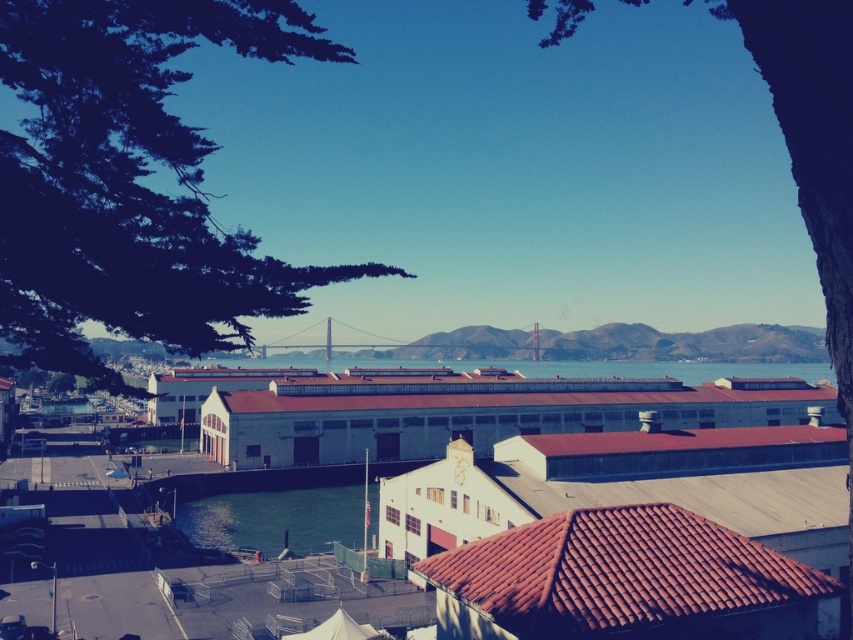
Between point (78, 22) and point (793, 371), which one is positioned behind?

Positioned behind is point (793, 371).

Find the location of a particular element. The image size is (853, 640). green leafy tree at upper left is located at coordinates (x=131, y=182).

Can you confirm if clear blue water at center is positioned to the left of metallic bridge at center?

Incorrect, clear blue water at center is not on the left side of metallic bridge at center.

Which of these two, clear blue water at center or metallic bridge at center, stands shorter?

With less height is clear blue water at center.

Is point (639, 371) positioned in front of point (318, 349)?

Yes, it is in front of point (318, 349).

Image resolution: width=853 pixels, height=640 pixels. What are the coordinates of `clear blue water at center` in the screenshot? It's located at (656, 369).

Can you confirm if green leafy tree at upper left is thinner than metallic bridge at center?

No, green leafy tree at upper left is not thinner than metallic bridge at center.

Between green leafy tree at upper left and metallic bridge at center, which one appears on the right side from the viewer's perspective?

Positioned to the right is metallic bridge at center.

Who is more forward, [67,186] or [296,336]?

Point [67,186]

Find the location of a particular element. The width and height of the screenshot is (853, 640). green leafy tree at upper left is located at coordinates (131, 182).